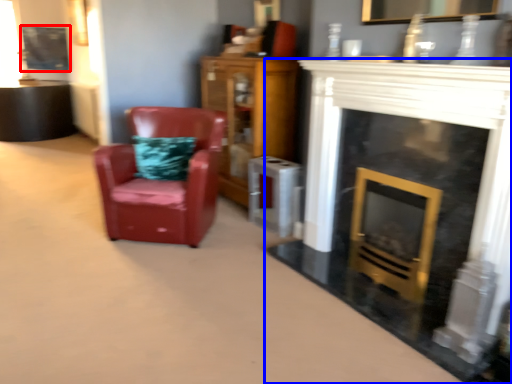
Question: Which point is further to the camera, picture frame (highlighted by a red box) or fireplace (highlighted by a blue box)?

Choices:
 (A) picture frame
 (B) fireplace

Answer: (A)